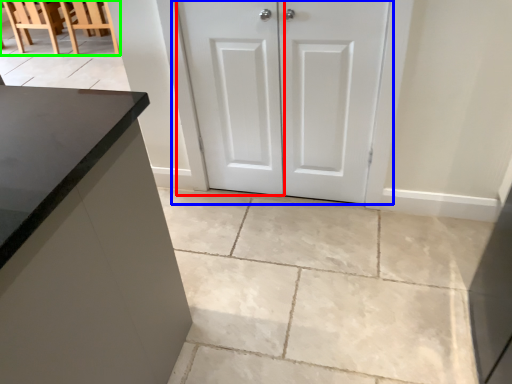
Question: Which object is positioned farthest from screen door (highlighted by a red box)? Select from door (highlighted by a blue box) and chair (highlighted by a green box).

Choices:
 (A) door
 (B) chair

Answer: (B)